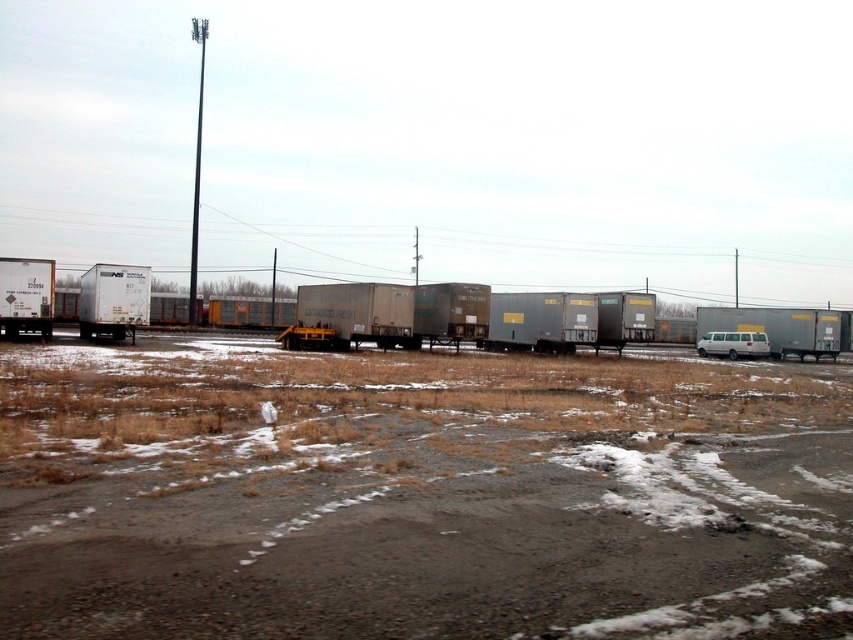
Question: Does silver metallic trailer truck at right have a larger size compared to white matte trailer truck at left?

Choices:
 (A) yes
 (B) no

Answer: (B)

Question: Which point is closer to the camera?

Choices:
 (A) gray matte freight car at center
 (B) silver metallic trailer truck at right
 (C) white matte trailer truck at left

Answer: (A)

Question: Does silver metallic trailer truck at right have a larger size compared to white matte trailer truck at left?

Choices:
 (A) yes
 (B) no

Answer: (B)

Question: Which object is farther from the camera taking this photo?

Choices:
 (A) white matte trailer truck at left
 (B) gray matte freight car at center

Answer: (A)

Question: Does gray matte freight car at center have a greater width compared to white matte trailer truck at left?

Choices:
 (A) yes
 (B) no

Answer: (A)

Question: Which point is closer to the camera taking this photo?

Choices:
 (A) (170, 314)
 (B) (798, 353)

Answer: (B)